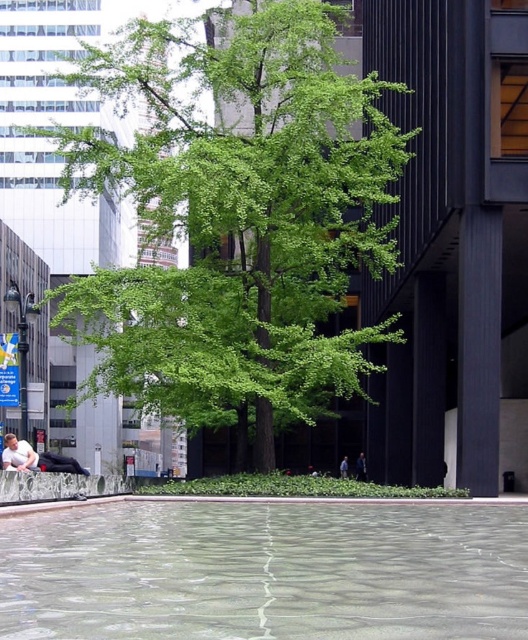
Question: Among these objects, which one is nearest to the camera?

Choices:
 (A) smooth concrete ledge at lower center
 (B) blue fabric person at center

Answer: (A)

Question: Which object is positioned farthest from the green leafy tree at center?

Choices:
 (A) blue fabric person at center
 (B) white cotton shirt at lower left

Answer: (A)

Question: Is dark blue fabric at lower center bigger than blue fabric person at center?

Choices:
 (A) no
 (B) yes

Answer: (B)

Question: Among these objects, which one is nearest to the camera?

Choices:
 (A) smooth concrete ledge at lower center
 (B) blue fabric person at center
 (C) dark blue fabric at lower center
 (D) white cotton shirt at lower left

Answer: (A)

Question: Is dark blue fabric at lower center to the right of blue fabric person at center from the viewer's perspective?

Choices:
 (A) no
 (B) yes

Answer: (B)

Question: Is green leafy tree at center to the left of clear glass water at center from the viewer's perspective?

Choices:
 (A) yes
 (B) no

Answer: (A)